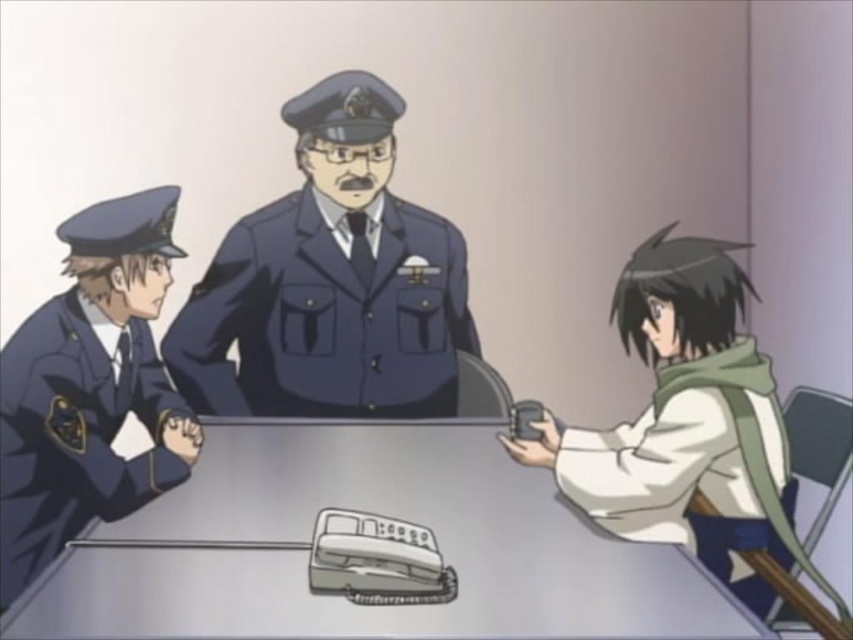
Question: Is matte blue uniform at center smaller than white matte scarf at lower right?

Choices:
 (A) yes
 (B) no

Answer: (A)

Question: Does metallic gray table at center have a lesser width compared to matte blue uniform at center?

Choices:
 (A) yes
 (B) no

Answer: (B)

Question: Estimate the real-world distances between objects in this image. Which object is closer to the white matte scarf at lower right?

Choices:
 (A) matte blue uniform at left
 (B) metallic gray table at center

Answer: (B)

Question: Does metallic gray table at center have a lesser width compared to matte blue uniform at left?

Choices:
 (A) no
 (B) yes

Answer: (A)

Question: Estimate the real-world distances between objects in this image. Which object is farther from the matte blue uniform at center?

Choices:
 (A) white matte scarf at lower right
 (B) matte blue uniform at left
 (C) metallic gray table at center

Answer: (A)

Question: Among these objects, which one is nearest to the camera?

Choices:
 (A) metallic gray table at center
 (B) white matte scarf at lower right

Answer: (A)